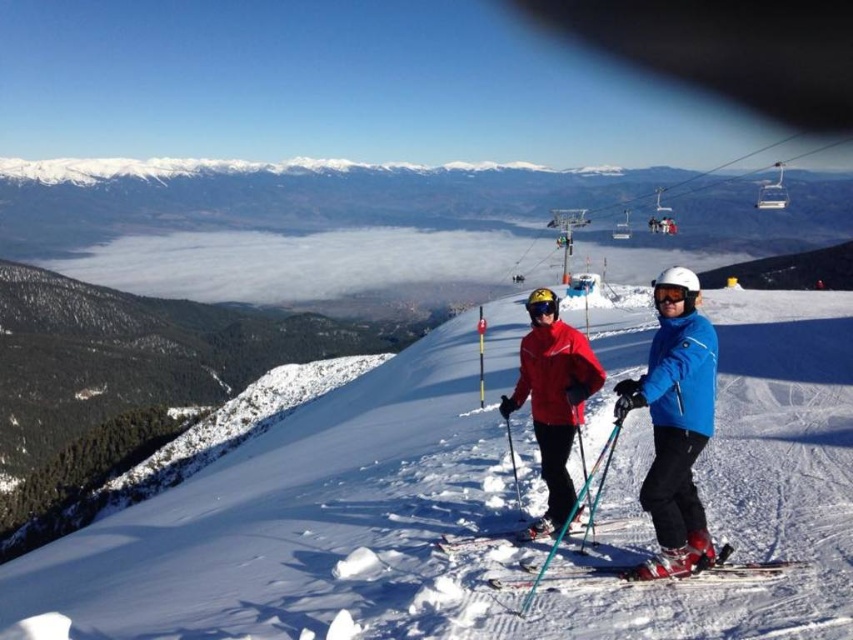
Does point (685, 419) come in front of point (653, 353)?

That is True.

Based on the photo, can you confirm if matte blue jacket at center is positioned to the left of blue matte ski jacket at right?

Indeed, matte blue jacket at center is positioned on the left side of blue matte ski jacket at right.

Who is more distant from viewer, (683, 417) or (700, 545)?

Positioned behind is point (683, 417).

Locate an element on the screen. The image size is (853, 640). matte blue jacket at center is located at coordinates (675, 428).

Who is lower down, matte red ski jacket at center or white matte goggles at center?

Positioned lower is matte red ski jacket at center.

Between matte red ski jacket at center and white matte goggles at center, which one has more height?

matte red ski jacket at center is taller.

Where is `matte red ski jacket at center`? matte red ski jacket at center is located at coordinates (554, 404).

Image resolution: width=853 pixels, height=640 pixels. Find the location of `white snow ski slope at center`. white snow ski slope at center is located at coordinates (469, 508).

Does white snow ski slope at center appear on the left side of shiny metallic ski at center?

Incorrect, white snow ski slope at center is not on the left side of shiny metallic ski at center.

Who is more forward, (x=614, y=472) or (x=582, y=524)?

Point (x=582, y=524)

At what (x,y) coordinates should I click in order to perform the action: click on white snow ski slope at center. Please return your answer as a coordinate pair (x, y). This screenshot has height=640, width=853. Looking at the image, I should click on (469, 508).